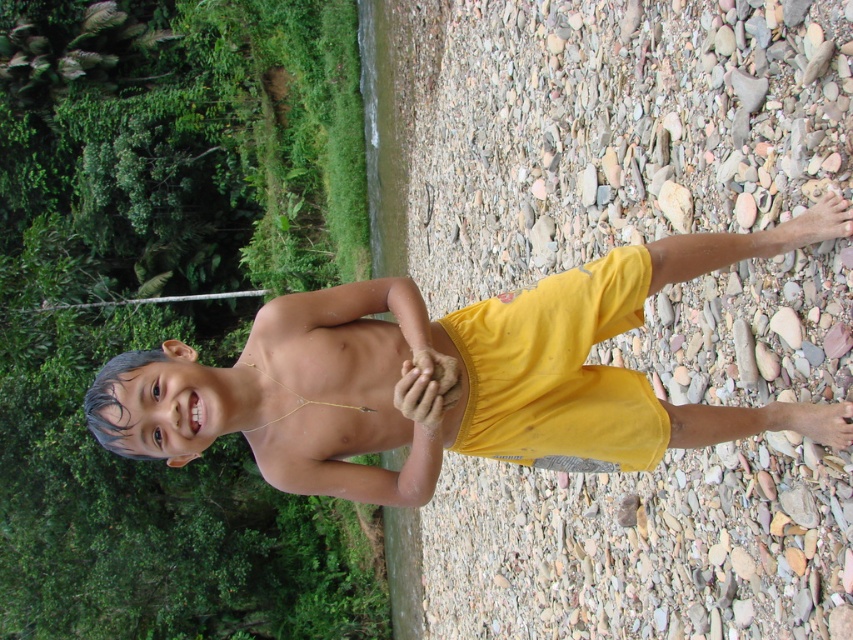
Question: Is yellow cotton shorts at center to the right of green leafy branch at upper left from the viewer's perspective?

Choices:
 (A) no
 (B) yes

Answer: (B)

Question: Which point is farther to the camera?

Choices:
 (A) green leafy branch at upper left
 (B) gold/yellow string at center

Answer: (A)

Question: Which point appears farthest from the camera in this image?

Choices:
 (A) pyautogui.click(x=73, y=307)
 (B) pyautogui.click(x=384, y=276)

Answer: (A)

Question: Is yellow cotton shorts at center positioned before green leafy branch at upper left?

Choices:
 (A) yes
 (B) no

Answer: (A)

Question: Which object is closer to the camera taking this photo?

Choices:
 (A) green leafy branch at upper left
 (B) gold/yellow string at center
 (C) yellow cotton shorts at center

Answer: (C)

Question: Observing the image, what is the correct spatial positioning of yellow cotton shorts at center in reference to green leafy branch at upper left?

Choices:
 (A) above
 (B) below

Answer: (B)